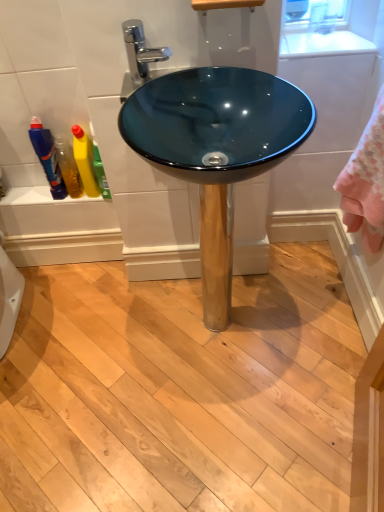
The height and width of the screenshot is (512, 384). Describe the element at coordinates (216, 149) in the screenshot. I see `teal glass bowl at center` at that location.

Locate an element on the screen. The height and width of the screenshot is (512, 384). yellow liquid at left, arranged as the second cleaning product when viewed from the left is located at coordinates pos(99,168).

The image size is (384, 512). I want to click on translucent plastic bottle at left, so click(47, 157).

How much space does yellow matte bottle at left, positioned as the 2th cleaning product in right-to-left order, occupy vertically?

yellow matte bottle at left, positioned as the 2th cleaning product in right-to-left order, is 26.70 centimeters in height.

Find the location of a particular element. teal glass bowl at center is located at coordinates (216, 149).

Can we say glossy glass bowl at center lies outside white glossy countertop at upper center?

Yes.

From a real-world perspective, does glossy glass bowl at center sit lower than white glossy countertop at upper center?

Yes, from a real-world perspective, glossy glass bowl at center is below white glossy countertop at upper center.

From the image's perspective, is glossy glass bowl at center on top of white glossy countertop at upper center?

No, from the image's perspective, glossy glass bowl at center is not on top of white glossy countertop at upper center.

Considering the positions of objects translucent plastic bottle at left and chrome metallic faucet at upper center in the image provided, who is in front, translucent plastic bottle at left or chrome metallic faucet at upper center?

chrome metallic faucet at upper center.

Is translucent plastic bottle at left wider than chrome metallic faucet at upper center?

No.

Is translucent plastic bottle at left to the left or to the right of chrome metallic faucet at upper center in the image?

translucent plastic bottle at left is positioned on chrome metallic faucet at upper center's left side.

Is translucent plastic bottle at left not near chrome metallic faucet at upper center?

No.

Is glossy glass bowl at center next to yellow liquid at left, arranged as the first cleaning product when viewed from the right, and touching it?

glossy glass bowl at center and yellow liquid at left, arranged as the first cleaning product when viewed from the right, are clearly separated.

From the image's perspective, is glossy glass bowl at center on top of yellow liquid at left, arranged as the first cleaning product when viewed from the right?

Yes.

Between glossy glass bowl at center and yellow liquid at left, arranged as the first cleaning product when viewed from the right, which one is positioned behind?

yellow liquid at left, arranged as the first cleaning product when viewed from the right, is behind.

Is point (320, 178) positioned after point (94, 164)?

Yes, point (320, 178) is farther from viewer.

Is translucent plastic bottles at left with teal glass bowl at center?

No, translucent plastic bottles at left is not next to teal glass bowl at center.

Which of these two, translucent plastic bottles at left or teal glass bowl at center, is smaller?

With smaller size is translucent plastic bottles at left.

Is translucent plastic bottles at left spatially inside teal glass bowl at center, or outside of it?

translucent plastic bottles at left is spatially situated outside teal glass bowl at center.

Looking at their sizes, would you say translucent plastic bottles at left is wider or thinner than teal glass bowl at center?

Clearly, translucent plastic bottles at left has less width compared to teal glass bowl at center.

Does white glossy countertop at upper center have a larger size compared to glossy glass bowl at center?

No.

From a real-world perspective, between white glossy countertop at upper center and glossy glass bowl at center, who is vertically lower?

glossy glass bowl at center is physically lower.

Which of these two, white glossy countertop at upper center or glossy glass bowl at center, is thinner?

glossy glass bowl at center.

From a real-world perspective, relative to translucent plastic bottle at left, is chrome metallic faucet at upper center vertically above or below?

Clearly, from a real-world perspective, chrome metallic faucet at upper center is above translucent plastic bottle at left.

Based on the photo, which object is closer to the camera, chrome metallic faucet at upper center or translucent plastic bottle at left?

chrome metallic faucet at upper center is closer to the camera.

Can you tell me how much chrome metallic faucet at upper center and translucent plastic bottle at left differ in facing direction?

2.01 degrees separate the facing orientations of chrome metallic faucet at upper center and translucent plastic bottle at left.

Is chrome metallic faucet at upper center looking in the opposite direction of translucent plastic bottle at left?

No, translucent plastic bottle at left is not at the back of chrome metallic faucet at upper center.

Does chrome metallic faucet at upper center have a greater width compared to glossy glass bowl at center?

Yes.

Considering the sizes of objects chrome metallic faucet at upper center and glossy glass bowl at center in the image provided, who is shorter, chrome metallic faucet at upper center or glossy glass bowl at center?

Standing shorter between the two is chrome metallic faucet at upper center.

Is chrome metallic faucet at upper center far from glossy glass bowl at center?

No.

From the image's perspective, between chrome metallic faucet at upper center and glossy glass bowl at center, which one is located above?

chrome metallic faucet at upper center appears higher in the image.

Find the location of a particular element. counter top on the left of glossy glass bowl at center is located at coordinates (323, 44).

You are a GUI agent. You are given a task and a screenshot of the screen. Output one action in this format:
    pyautogui.click(x=<x>, y=<y>)
    Task: Click on the bottle located below the chrome metallic faucet at upper center (from the image's perspective)
    The image size is (384, 512).
    Given the screenshot: What is the action you would take?
    pyautogui.click(x=47, y=157)

When comparing their distances from teal glass bowl at center, does chrome metallic faucet at upper center or yellow matte bottle at left, positioned as the 2th cleaning product in right-to-left order, seem closer?

chrome metallic faucet at upper center.

From the picture: From the image, which object appears to be nearer to teal glass bowl at center, translucent plastic bottle at left or yellow matte bottle at left, positioned as the 2th cleaning product in right-to-left order?

yellow matte bottle at left, positioned as the 2th cleaning product in right-to-left order, is positioned closer to the anchor teal glass bowl at center.

When comparing their distances from translucent plastic bottles at left, does translucent plastic bottle at left or yellow matte bottle at left, the first cleaning product in the left-to-right sequence, seem closer?

Based on the image, translucent plastic bottle at left appears to be nearer to translucent plastic bottles at left.

Estimate the real-world distances between objects in this image. Which object is further from teal glass bowl at center, yellow matte bottle at left, positioned as the 2th cleaning product in right-to-left order, or white glossy countertop at upper center?

yellow matte bottle at left, positioned as the 2th cleaning product in right-to-left order, lies further to teal glass bowl at center than the other object.

Which object lies further to the anchor point yellow matte bottle at left, positioned as the 2th cleaning product in right-to-left order, translucent plastic bottles at left or translucent plastic bottle at left?

translucent plastic bottle at left.

Which object lies nearer to the anchor point yellow liquid at left, arranged as the first cleaning product when viewed from the right, glossy glass bowl at center or yellow matte bottle at left, the first cleaning product in the left-to-right sequence?

yellow matte bottle at left, the first cleaning product in the left-to-right sequence.

Looking at the image, which one is located further to teal glass bowl at center, yellow liquid at left, arranged as the first cleaning product when viewed from the right, or glossy glass bowl at center?

yellow liquid at left, arranged as the first cleaning product when viewed from the right, is positioned further to the anchor teal glass bowl at center.

From the image, which object appears to be farther from teal glass bowl at center, yellow liquid at left, arranged as the second cleaning product when viewed from the left, or yellow matte bottle at left, positioned as the 2th cleaning product in right-to-left order?

Based on the image, yellow matte bottle at left, positioned as the 2th cleaning product in right-to-left order, appears to be further to teal glass bowl at center.

The width and height of the screenshot is (384, 512). Identify the location of bottle between teal glass bowl at center and translucent plastic bottles at left from front to back. (47, 157).

Locate an element on the screen. The image size is (384, 512). cleaning product between teal glass bowl at center and yellow matte bottle at left, positioned as the 2th cleaning product in right-to-left order, along the z-axis is located at coordinates point(99,168).

Where is `sink between translucent plastic bottles at left and glossy glass bowl at center from left to right`? sink between translucent plastic bottles at left and glossy glass bowl at center from left to right is located at coordinates (216, 149).

You are a GUI agent. You are given a task and a screenshot of the screen. Output one action in this format:
    pyautogui.click(x=<x>, y=<y>)
    Task: Click on the tap between teal glass bowl at center and yellow matte bottle at left, the first cleaning product in the left-to-right sequence, in the front-back direction
    This screenshot has width=384, height=512.
    Given the screenshot: What is the action you would take?
    pyautogui.click(x=140, y=51)